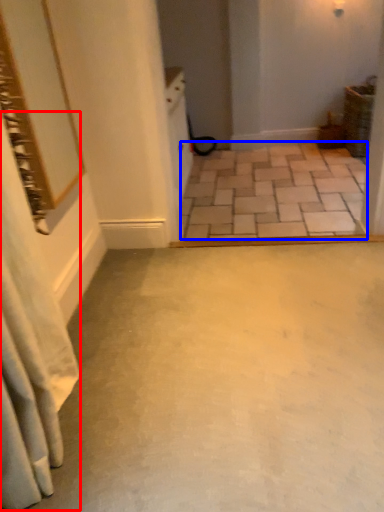
Question: Which point is closer to the camera, shower curtain (highlighted by a red box) or concrete (highlighted by a blue box)?

Choices:
 (A) shower curtain
 (B) concrete

Answer: (A)